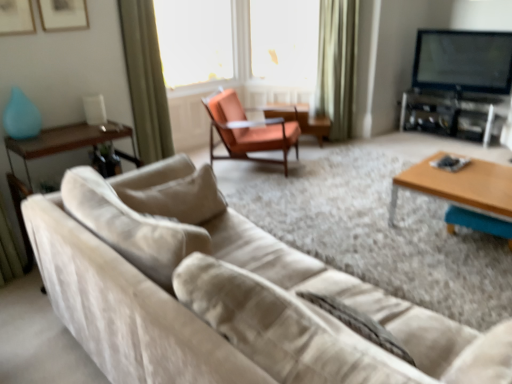
Question: From a real-world perspective, is green velvet curtain at upper center, which is counted as the second curtain, starting from the left, over flat-screen tv at upper right?

Choices:
 (A) yes
 (B) no

Answer: (B)

Question: Considering the relative sizes of green velvet curtain at upper center, which is counted as the second curtain, starting from the left, and flat-screen tv at upper right in the image provided, is green velvet curtain at upper center, which is counted as the second curtain, starting from the left, thinner than flat-screen tv at upper right?

Choices:
 (A) yes
 (B) no

Answer: (B)

Question: Does green velvet curtain at upper center, which is counted as the second curtain, starting from the left, have a smaller size compared to flat-screen tv at upper right?

Choices:
 (A) yes
 (B) no

Answer: (B)

Question: Is flat-screen tv at upper right at the back of green velvet curtain at upper center, which is counted as the second curtain, starting from the left?

Choices:
 (A) yes
 (B) no

Answer: (B)

Question: Is there a large distance between green velvet curtain at upper center, positioned as the 2th curtain in front-to-back order, and flat-screen tv at upper right?

Choices:
 (A) yes
 (B) no

Answer: (A)

Question: In terms of width, does flat-screen tv at upper right look wider or thinner when compared to orange leather chair at center?

Choices:
 (A) thin
 (B) wide

Answer: (A)

Question: Choose the correct answer: Is flat-screen tv at upper right inside orange leather chair at center or outside it?

Choices:
 (A) outside
 (B) inside

Answer: (A)

Question: Is point (477, 77) closer or farther from the camera than point (278, 139)?

Choices:
 (A) closer
 (B) farther

Answer: (B)

Question: Is flat-screen tv at upper right bigger or smaller than orange leather chair at center?

Choices:
 (A) small
 (B) big

Answer: (A)

Question: In terms of height, does orange leather chair at center look taller or shorter compared to suede beige couch at lower left?

Choices:
 (A) short
 (B) tall

Answer: (A)

Question: Do you think orange leather chair at center is within suede beige couch at lower left, or outside of it?

Choices:
 (A) inside
 (B) outside

Answer: (B)

Question: In terms of size, does orange leather chair at center appear bigger or smaller than suede beige couch at lower left?

Choices:
 (A) big
 (B) small

Answer: (B)

Question: From the image's perspective, is orange leather chair at center positioned above or below suede beige couch at lower left?

Choices:
 (A) below
 (B) above

Answer: (B)

Question: From their relative heights in the image, would you say flat-screen tv at upper right is taller or shorter than green velvet curtain at upper center, positioned as the first curtain in back-to-front order?

Choices:
 (A) short
 (B) tall

Answer: (A)

Question: Visually, is flat-screen tv at upper right positioned to the left or to the right of green velvet curtain at upper center, which is counted as the second curtain, starting from the left?

Choices:
 (A) left
 (B) right

Answer: (B)